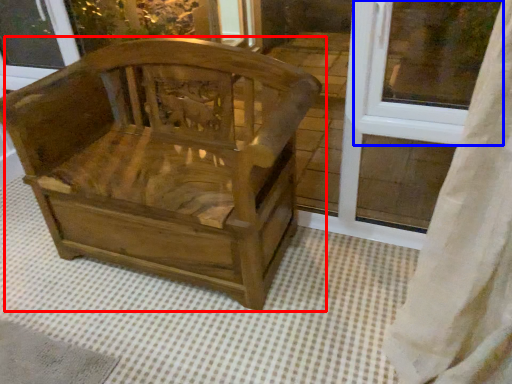
Question: Which point is closer to the camera, chair (highlighted by a red box) or window frame (highlighted by a blue box)?

Choices:
 (A) chair
 (B) window frame

Answer: (A)